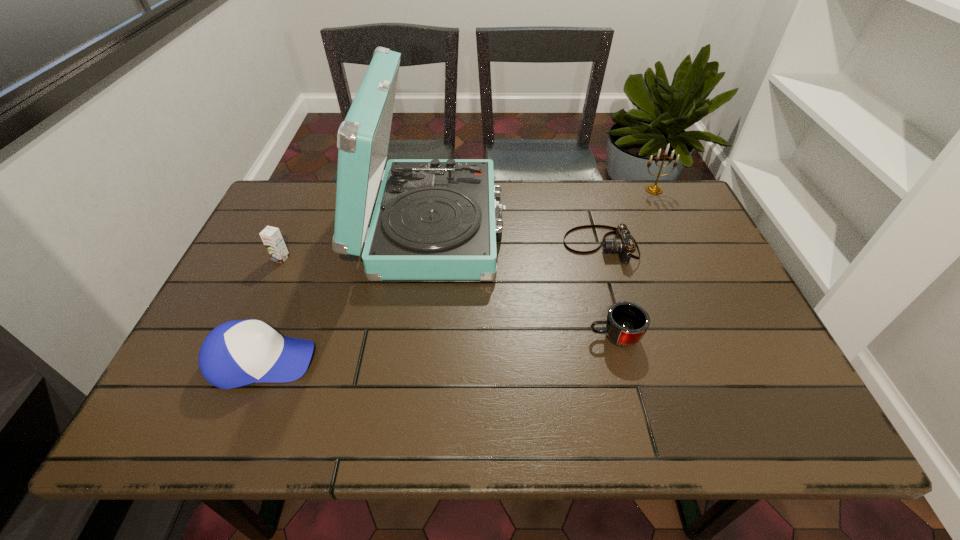
Identify the location of vacant space at the far right corner of the desktop. The width and height of the screenshot is (960, 540). (675, 217).

Identify the location of free location at the near right corner of the desktop. [x=780, y=424].

This screenshot has width=960, height=540. I want to click on empty space between the mug and the camera, so click(608, 291).

At what (x,y) coordinates should I click in order to perform the action: click on unoccupied position between the chocolate milk and the second shortest object. Please return your answer as a coordinate pair (x, y). Looking at the image, I should click on (447, 298).

You are a GUI agent. You are given a task and a screenshot of the screen. Output one action in this format:
    pyautogui.click(x=<x>, y=<y>)
    Task: Click on the empty location between the rightmost object and the mug
    The image size is (960, 540).
    Given the screenshot: What is the action you would take?
    pyautogui.click(x=635, y=263)

Find the location of `vacant area that lies between the shortest object and the second shortest object`. vacant area that lies between the shortest object and the second shortest object is located at coordinates (608, 291).

This screenshot has height=540, width=960. I want to click on the second closest object to the chocolate milk, so click(x=236, y=353).

Identify which object is the nearest to the chocolate milk. Please provide its 2D coordinates. Your answer should be formatted as a tuple, i.e. [(x, y)], where the tuple contains the x and y coordinates of a point satisfying the conditions above.

[(435, 219)]

This screenshot has height=540, width=960. I want to click on vacant space that satisfies the following two spatial constraints: 1. on the back side of the chocolate milk; 2. on the right side of the fifth shortest object, so click(312, 190).

This screenshot has height=540, width=960. I want to click on vacant region that satisfies the following two spatial constraints: 1. on the front side of the candelabrum; 2. on the side of the mug with the handle, so click(723, 336).